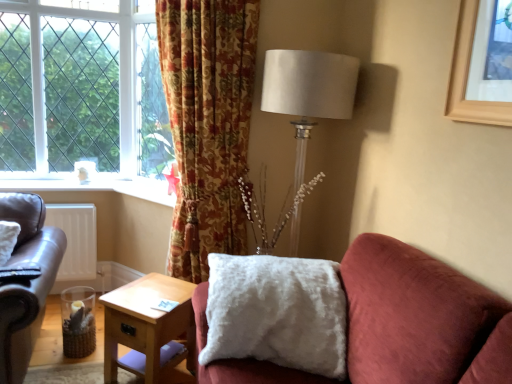
Question: In the image, is light wood/texture side table at lower center positioned in front of or behind green leafy tree at left?

Choices:
 (A) behind
 (B) front

Answer: (B)

Question: Is light wood/texture side table at lower center inside or outside of green leafy tree at left?

Choices:
 (A) inside
 (B) outside

Answer: (B)

Question: Which of these objects is positioned closest to the floral-patterned fabric curtain at upper center?

Choices:
 (A) satin white lampshade at upper right
 (B) leather couch at left
 (C) light wood/texture side table at lower center
 (D) white matte radiator at lower left
 (E) green leafy tree at left

Answer: (A)

Question: Based on their relative distances, which object is nearer to the green leafy tree at left?

Choices:
 (A) satin white lampshade at upper right
 (B) white fluffy pillow at center
 (C) light wood/texture side table at lower center
 (D) wooden picture frame at upper right
 (E) floral-patterned fabric curtain at upper center

Answer: (E)